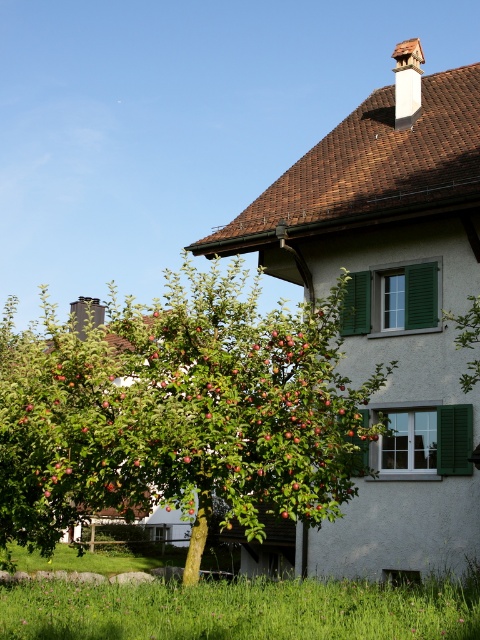
Question: Is green leafy tree at center positioned at the back of green grass at lower center?

Choices:
 (A) yes
 (B) no

Answer: (A)

Question: Can you confirm if green leafy tree at center is positioned above green grass at lower center?

Choices:
 (A) no
 (B) yes

Answer: (A)

Question: Can you confirm if green leafy tree at center is thinner than green grass at lower center?

Choices:
 (A) no
 (B) yes

Answer: (A)

Question: Which of the following is the closest to the observer?

Choices:
 (A) green leafy tree at center
 (B) green grass at lower center

Answer: (B)

Question: Which point is farther from the camera taking this photo?

Choices:
 (A) tap(200, 381)
 (B) tap(308, 616)

Answer: (A)